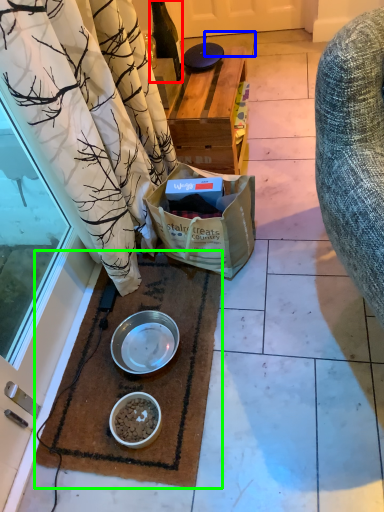
Question: Estimate the real-world distances between objects in this image. Which object is closer to bottle (highlighted by a red box), tile (highlighted by a blue box) or mat (highlighted by a green box)?

Choices:
 (A) tile
 (B) mat

Answer: (B)